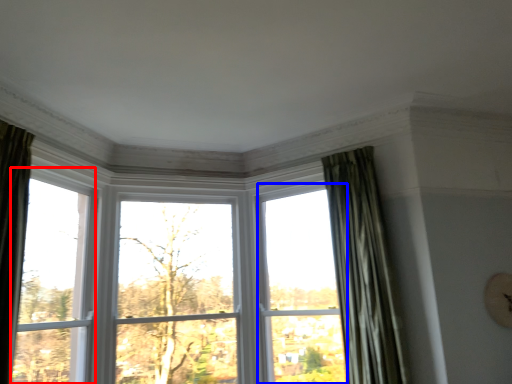
Question: Among these objects, which one is nearest to the camera, window (highlighted by a red box) or window (highlighted by a blue box)?

Choices:
 (A) window
 (B) window

Answer: (A)